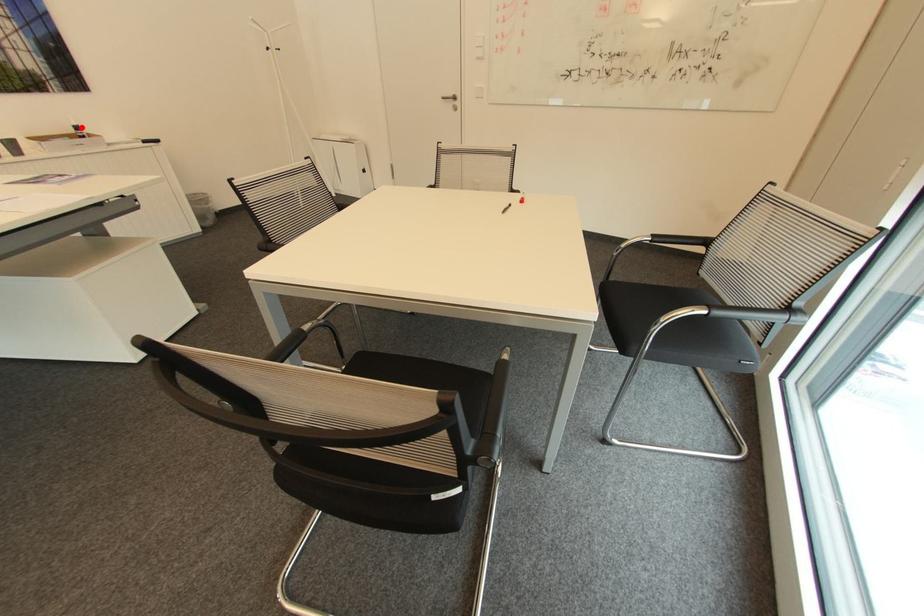
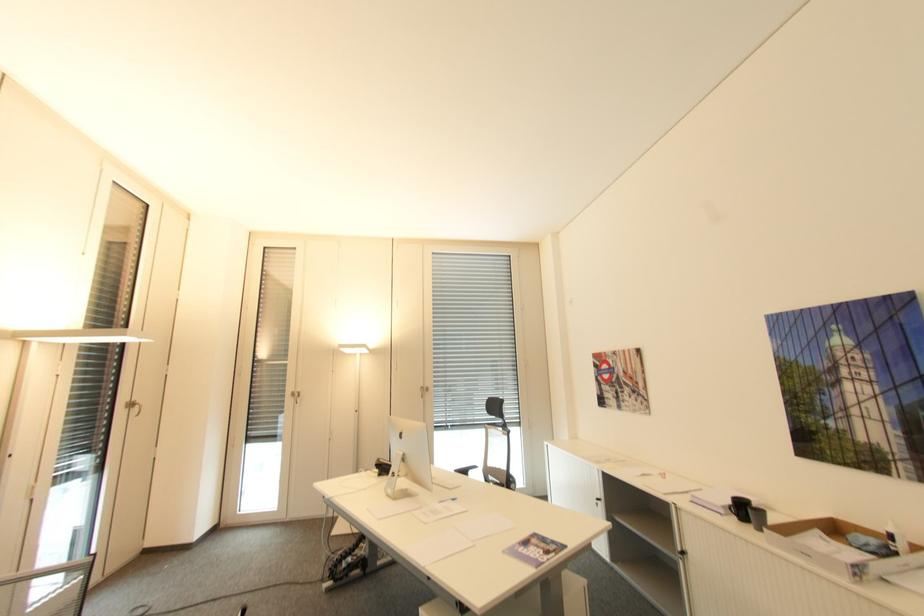
Find the pixel in the second image that matches the highlighted location in the first image.

(895, 537)